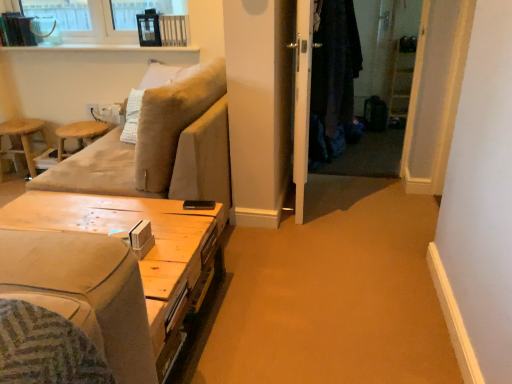
Question: Is wooden stool at left, acting as the second bar stool starting from the right, next to white glossy screen door at center and touching it?

Choices:
 (A) no
 (B) yes

Answer: (A)

Question: Does wooden stool at left, arranged as the 1th bar stool when viewed from the left, lie behind white glossy screen door at center?

Choices:
 (A) no
 (B) yes

Answer: (B)

Question: Is wooden stool at left, acting as the second bar stool starting from the right, shorter than white glossy screen door at center?

Choices:
 (A) no
 (B) yes

Answer: (B)

Question: Considering the relative sizes of wooden stool at left, arranged as the 1th bar stool when viewed from the left, and white glossy screen door at center in the image provided, is wooden stool at left, arranged as the 1th bar stool when viewed from the left, thinner than white glossy screen door at center?

Choices:
 (A) yes
 (B) no

Answer: (B)

Question: Is point (57, 160) positioned closer to the camera than point (318, 14)?

Choices:
 (A) farther
 (B) closer

Answer: (A)

Question: Considering the positions of wooden bar stool at left, which is the 1th bar stool from right to left, and dark woolen robe at center in the image, is wooden bar stool at left, which is the 1th bar stool from right to left, taller or shorter than dark woolen robe at center?

Choices:
 (A) short
 (B) tall

Answer: (A)

Question: Considering the positions of wooden bar stool at left, positioned as the 2th bar stool in left-to-right order, and dark woolen robe at center in the image, is wooden bar stool at left, positioned as the 2th bar stool in left-to-right order, bigger or smaller than dark woolen robe at center?

Choices:
 (A) small
 (B) big

Answer: (A)

Question: Is wooden bar stool at left, which is the 1th bar stool from right to left, in front of or behind dark woolen robe at center in the image?

Choices:
 (A) front
 (B) behind

Answer: (B)

Question: Choose the correct answer: Is white glossy screen door at center inside beige fabric couch at left or outside it?

Choices:
 (A) outside
 (B) inside

Answer: (A)

Question: Would you say white glossy screen door at center is to the left or to the right of beige fabric couch at left in the picture?

Choices:
 (A) left
 (B) right

Answer: (B)

Question: In the image, is white glossy screen door at center positioned in front of or behind beige fabric couch at left?

Choices:
 (A) front
 (B) behind

Answer: (B)

Question: From the image's perspective, is white glossy screen door at center positioned above or below beige fabric couch at left?

Choices:
 (A) above
 (B) below

Answer: (A)

Question: Is woodenmaterial/texturetable at lower left taller or shorter than white glossy screen door at center?

Choices:
 (A) tall
 (B) short

Answer: (B)

Question: Based on their positions, is woodenmaterial/texturetable at lower left located to the left or right of white glossy screen door at center?

Choices:
 (A) left
 (B) right

Answer: (A)